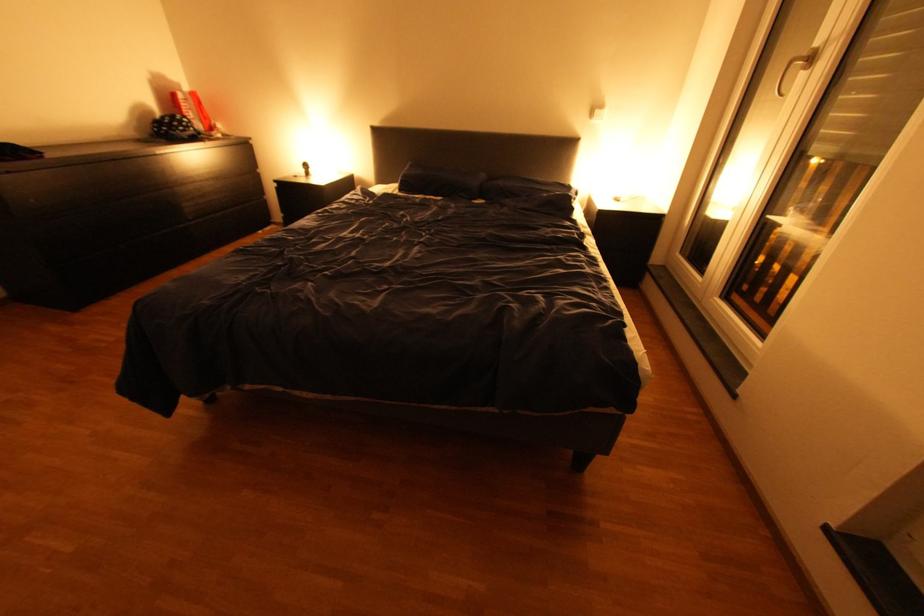
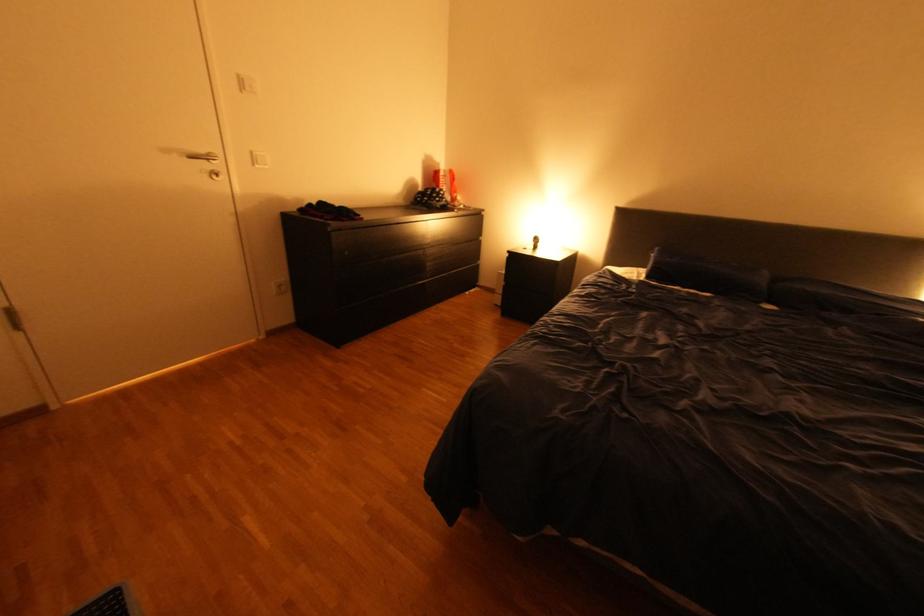
Where in the second image is the point corresponding to (43,200) from the first image?

(357, 253)